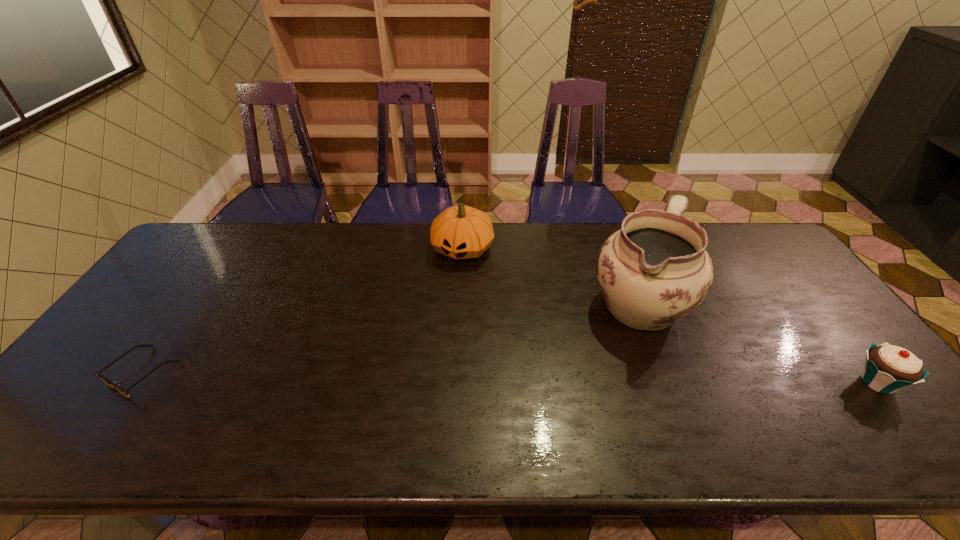
Image resolution: width=960 pixels, height=540 pixels. In order to click on blank area in the image that satisfies the following two spatial constraints: 1. on the front side of the third object from right to left; 2. on the right side of the third object from left to right in this screenshot , I will do `click(460, 304)`.